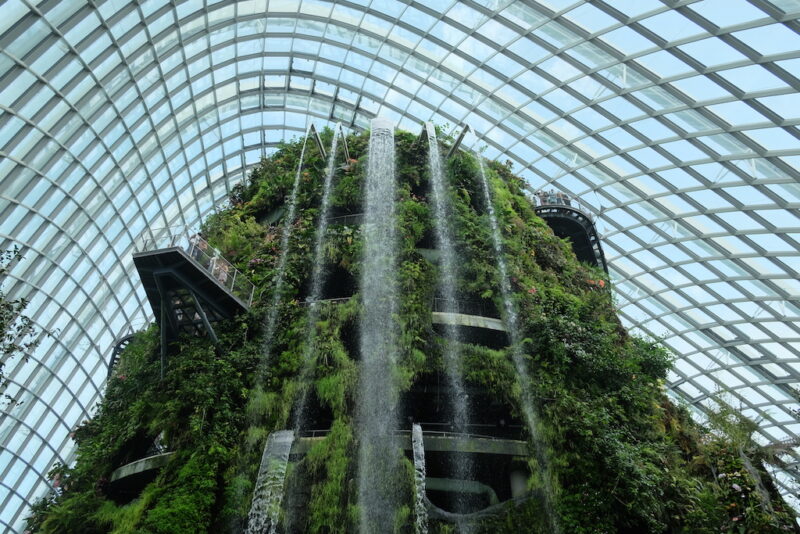
Where is `glass`? The image size is (800, 534). glass is located at coordinates (206, 257), (168, 237).